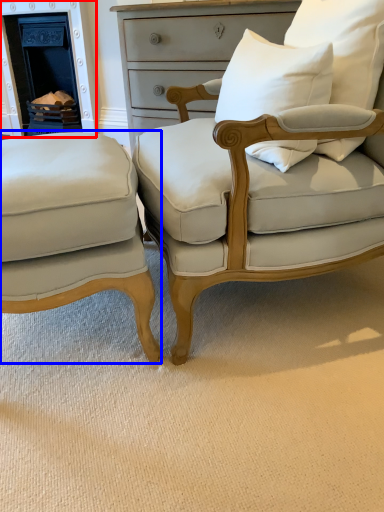
Question: Which of the following is the closest to the observer, fireplace (highlighted by a red box) or chair (highlighted by a blue box)?

Choices:
 (A) fireplace
 (B) chair

Answer: (B)